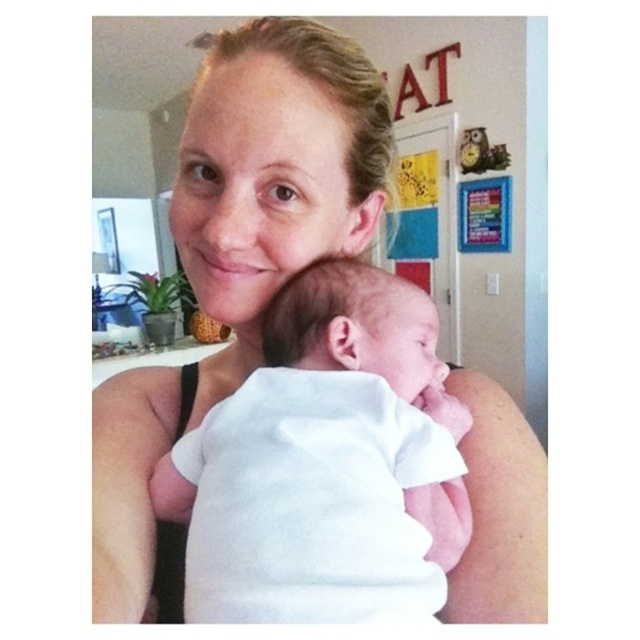
Who is taller, matte white tank top at center or white soft baby at center?

Standing taller between the two is matte white tank top at center.

Who is lower down, matte white tank top at center or white soft baby at center?

white soft baby at center is below.

Between point (189, 225) and point (349, 492), which one is positioned behind?

Point (189, 225)

Where is `matte white tank top at center`? The height and width of the screenshot is (640, 640). matte white tank top at center is located at coordinates (273, 173).